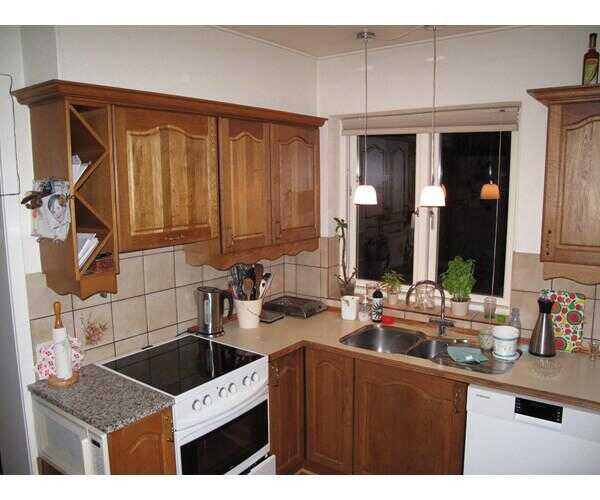
This screenshot has width=600, height=500. I want to click on tile backsplash, off light brown, so click(x=140, y=317).